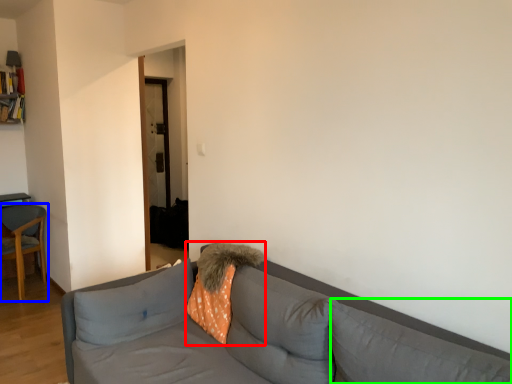
Question: Which is nearer to the throw pillow (highlighted by a red box)? chair (highlighted by a blue box) or pillow (highlighted by a green box).

Choices:
 (A) chair
 (B) pillow

Answer: (B)